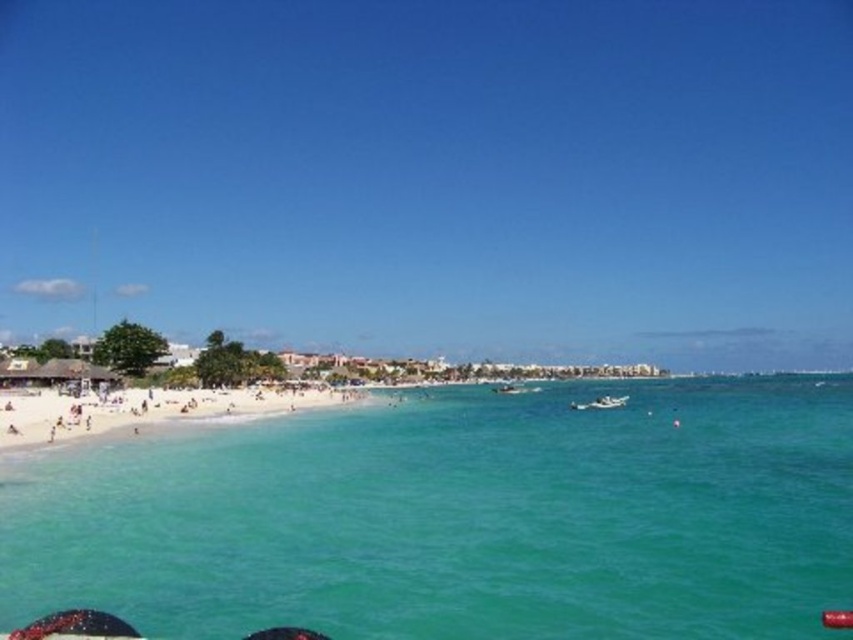
Question: Which object is farther from the camera taking this photo?

Choices:
 (A) white glossy boat at lower center
 (B) clear blue water at beach center

Answer: (A)

Question: Can you confirm if clear blue water at beach center is positioned below white glossy boat at lower center?

Choices:
 (A) no
 (B) yes

Answer: (B)

Question: From the image, what is the correct spatial relationship of clear blue water at beach center in relation to white sand beach at lower left?

Choices:
 (A) left
 (B) right

Answer: (B)

Question: Which object appears closest to the camera in this image?

Choices:
 (A) clear blue water at beach center
 (B) white glossy boat at lower center

Answer: (A)

Question: Is clear blue water at beach center positioned in front of white glossy boat at lower center?

Choices:
 (A) no
 (B) yes

Answer: (B)

Question: Estimate the real-world distances between objects in this image. Which object is closer to the white sand beach at lower left?

Choices:
 (A) white glossy boat at lower center
 (B) clear blue water at beach center

Answer: (B)